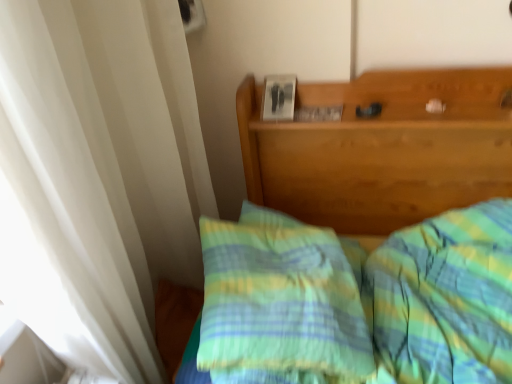
Question: Is green striped pillow at center in front of or behind green plaid bedspread at center in the image?

Choices:
 (A) front
 (B) behind

Answer: (B)

Question: From the image's perspective, is green striped pillow at center located above or below green plaid bedspread at center?

Choices:
 (A) above
 (B) below

Answer: (A)

Question: Does point (223, 362) appear closer or farther from the camera than point (413, 182)?

Choices:
 (A) farther
 (B) closer

Answer: (B)

Question: From a real-world perspective, is green plaid bedspread at center positioned above or below green striped pillow at center?

Choices:
 (A) below
 (B) above

Answer: (A)

Question: Looking at the image, does green plaid bedspread at center seem bigger or smaller compared to green striped pillow at center?

Choices:
 (A) big
 (B) small

Answer: (A)

Question: From their relative heights in the image, would you say green plaid bedspread at center is taller or shorter than green striped pillow at center?

Choices:
 (A) tall
 (B) short

Answer: (A)

Question: Does point (371, 86) appear closer or farther from the camera than point (232, 283)?

Choices:
 (A) farther
 (B) closer

Answer: (A)